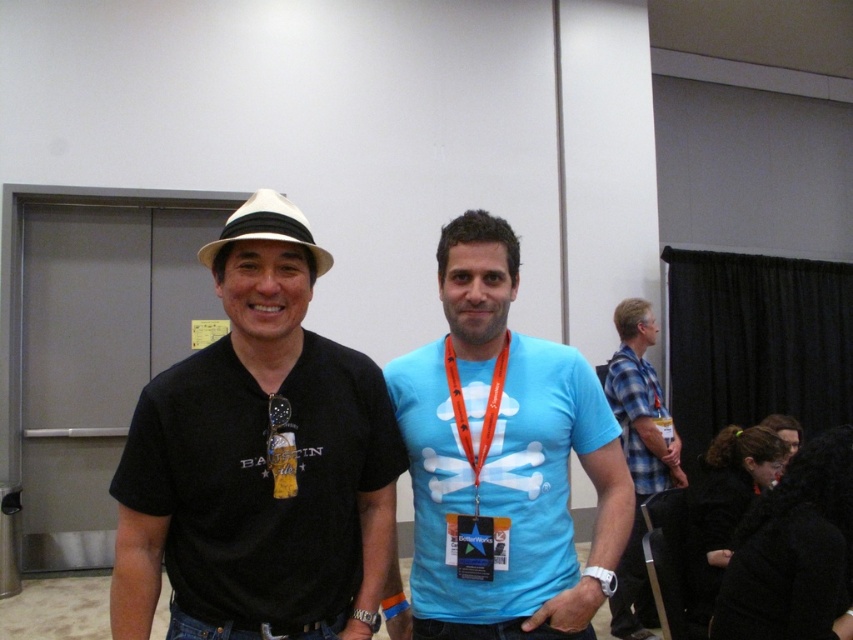
You are organizing a photo shoot and need to ensure that the black matte hat at left and the blue plaid shirt at right are both visible in the frame. Given that the camera has a fixed width, which item requires more horizontal space to be fully captured?

The black matte hat at left requires more horizontal space because its width surpasses that of the blue plaid shirt at right.

Consider the image. You are standing in front of the camera and want to know how far the point at coordinates (312, 237) is from the camera. Can you determine the distance?

The point at coordinates (312, 237) is 1.35 meters away from the camera.